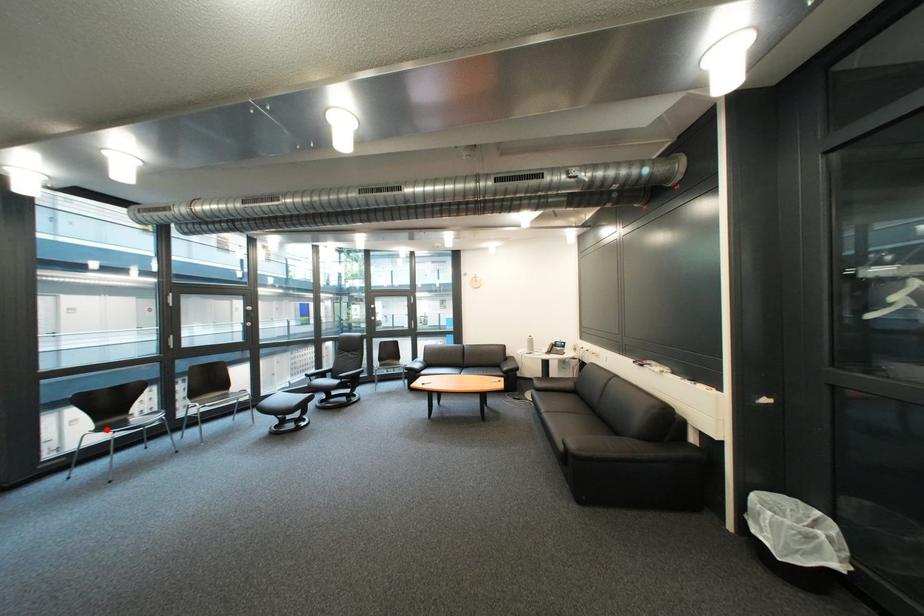
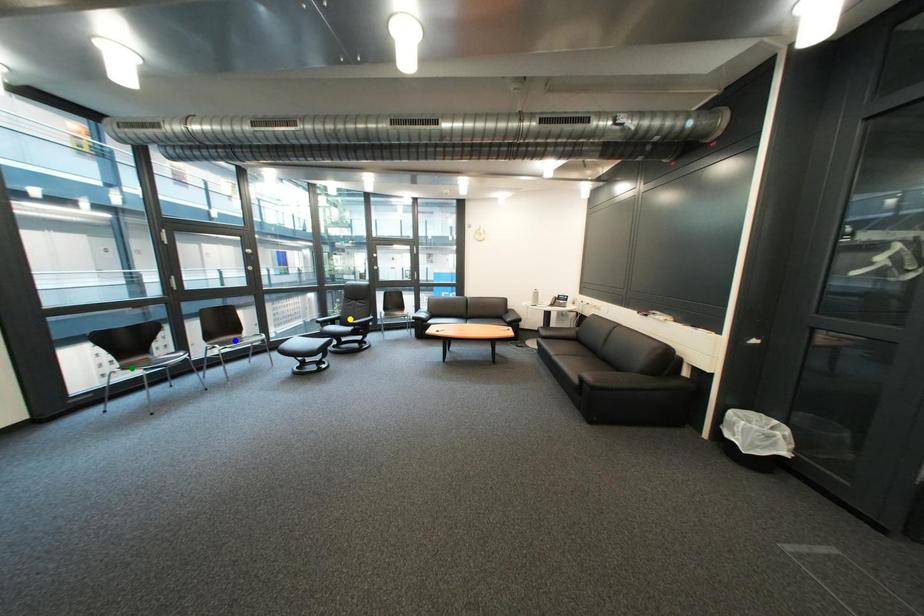
Question: I am providing you with two images of the same scene from different viewpoints. A red point is marked on the first image. You are given multiple points on the second image. Which point in image 2 is actually the same real-world point as the red point in image 1?

Choices:
 (A) yellow point
 (B) blue point
 (C) green point

Answer: (C)